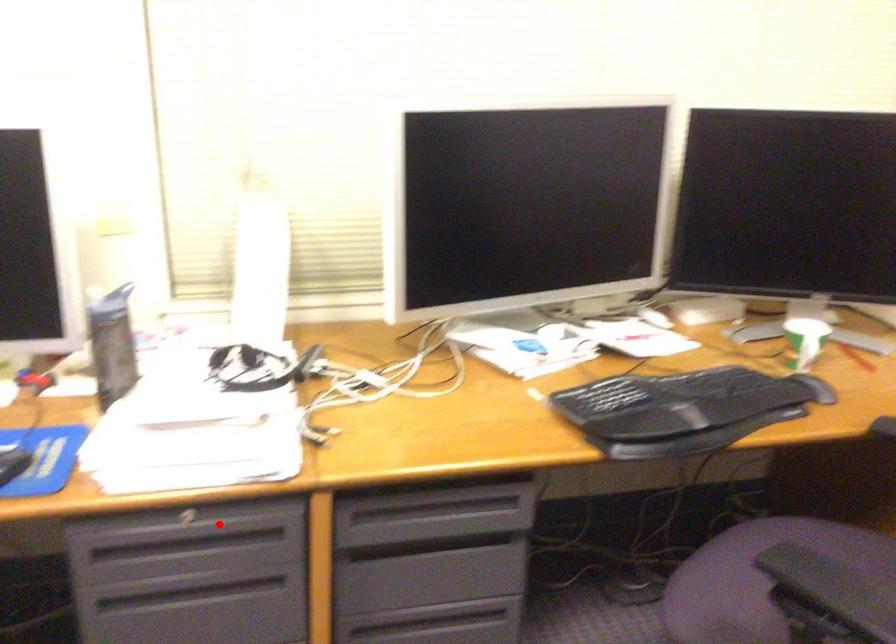
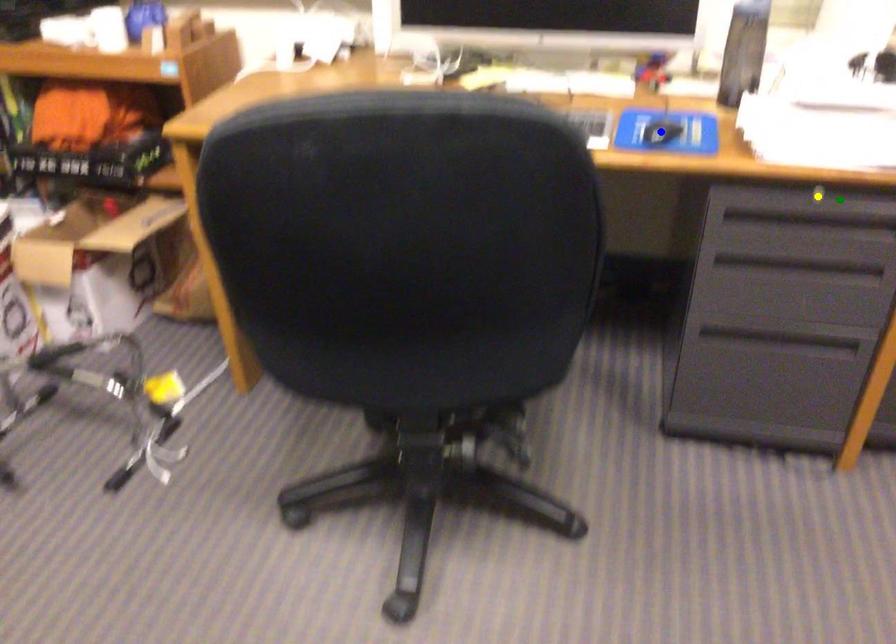
Question: I am providing you with two images of the same scene from different viewpoints. A red point is marked on the first image. You are given multiple points on the second image. Which point in image 2 represents the same 3d spot as the red point in image 1?

Choices:
 (A) blue point
 (B) green point
 (C) yellow point

Answer: (B)